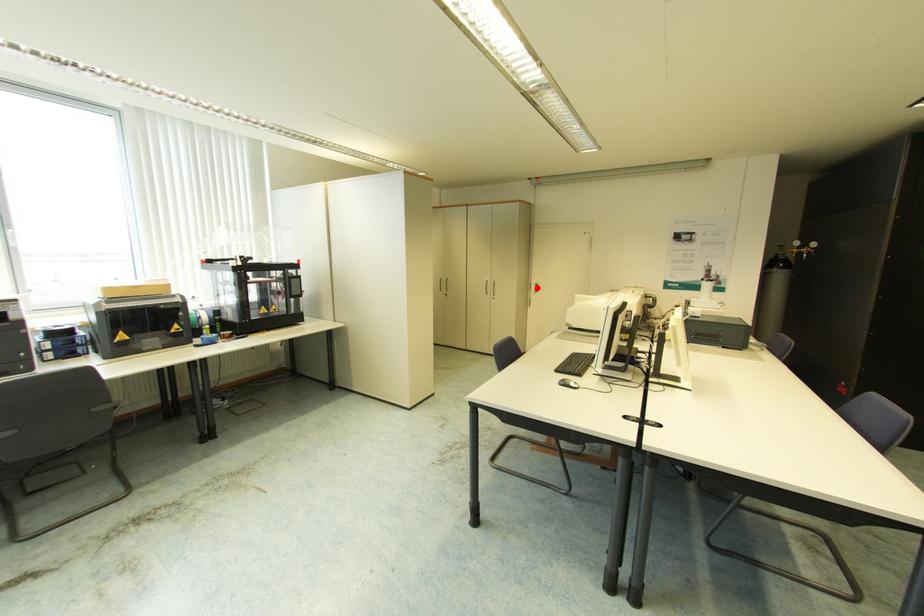
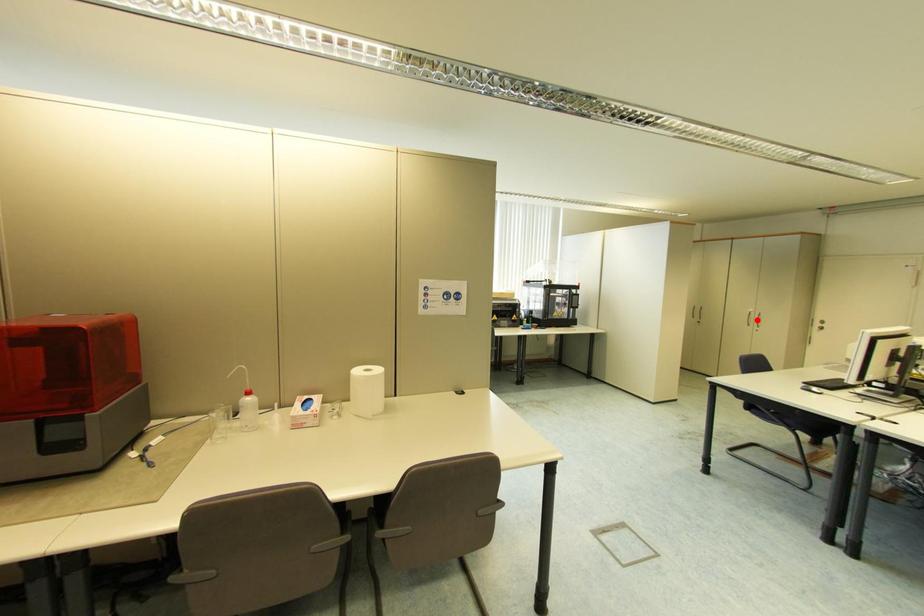
I am providing you with two images of the same scene from different viewpoints. A red point is marked on the first image and another point is marked on the second image. Is the red point in image1 aligned with the point shown in image2?

No